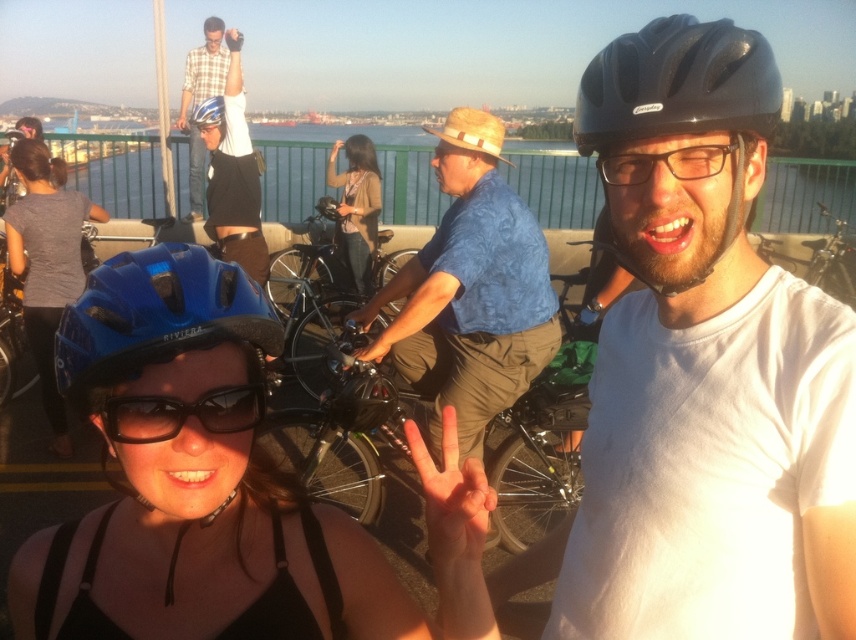
You are a photographer standing at the waterfront and want to take a photo of the clear plastic glasses at center and the matte blue helmet at upper center. Which object should you focus on first to ensure both are in the frame?

The clear plastic glasses at center is in front of the matte blue helmet at upper center, so you should focus on the clear plastic glasses at center first to ensure both are in the frame.

You are a photographer standing at the waterfront bridge. You see the black matte helmet at center and the blue matte helmet at lower left. Which helmet is positioned lower in the image?

The black matte helmet at center is located below the blue matte helmet at lower left, so it is positioned lower in the image.

You are a photographer standing in front of the waterfront scene. You notice the plaid shirt at upper center and the matte blue helmet at upper center in your viewfinder. Which object is wider when viewed from your current position?

The plaid shirt at upper center is wider than the matte blue helmet at upper center.